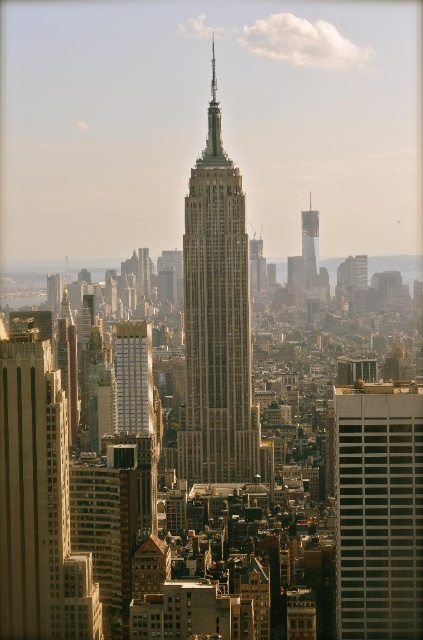
What do you see at coordinates (216, 321) in the screenshot? This screenshot has height=640, width=423. I see `beige stone tower at center` at bounding box center [216, 321].

Is beige stone tower at center below gray concrete building at right?

No.

Where is `beige stone tower at center`? This screenshot has width=423, height=640. beige stone tower at center is located at coordinates pos(216,321).

Can you confirm if beige stone tower at center is bigger than smooth concrete skyscraper at center?

Correct, beige stone tower at center is larger in size than smooth concrete skyscraper at center.

Where is `beige stone tower at center`? The width and height of the screenshot is (423, 640). beige stone tower at center is located at coordinates (216, 321).

Image resolution: width=423 pixels, height=640 pixels. I want to click on beige stone tower at center, so click(x=216, y=321).

Between point (414, 563) and point (313, 252), which one is positioned behind?

Positioned behind is point (414, 563).

Does gray concrete building at right appear on the left side of smooth concrete skyscraper at center?

No, gray concrete building at right is not to the left of smooth concrete skyscraper at center.

Between point (343, 476) and point (304, 225), which one is positioned behind?

Point (343, 476)

The image size is (423, 640). I want to click on gray concrete building at right, so click(x=379, y=509).